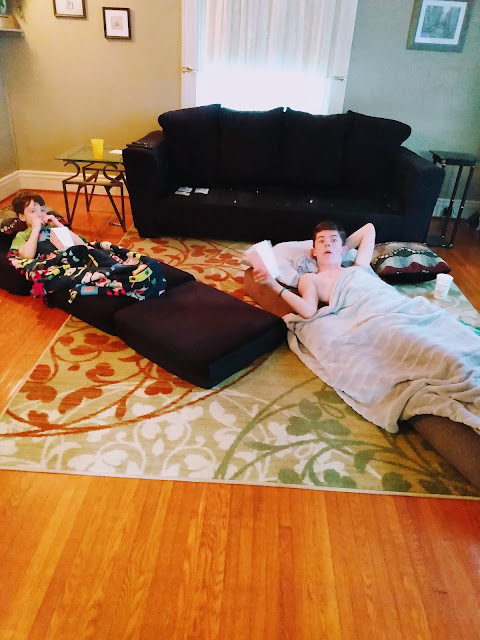
Where is `handles`? The image size is (480, 640). handles is located at coordinates (337, 76), (187, 68).